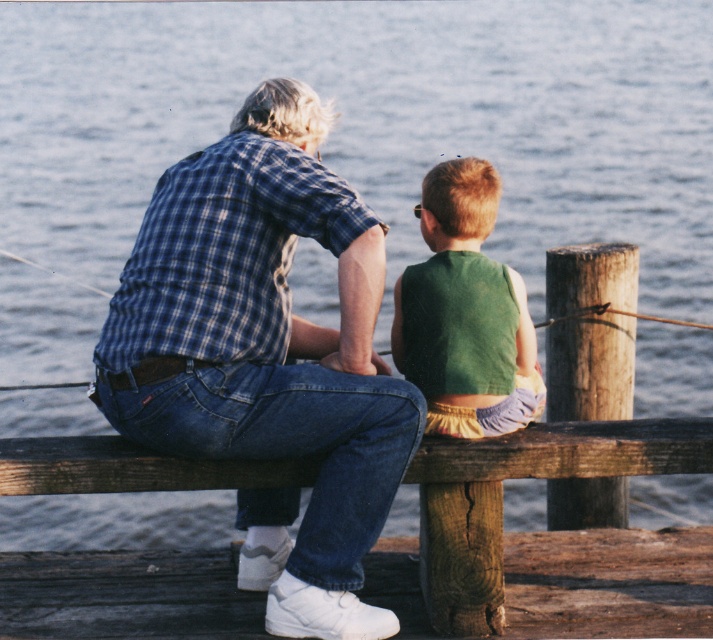
Question: Which of the following is the farthest from the observer?

Choices:
 (A) wooden bench at center
 (B) green fabric vest at center

Answer: (A)

Question: Which point is closer to the camera taking this photo?

Choices:
 (A) (461, 340)
 (B) (318, 634)

Answer: (B)

Question: Can you confirm if blue plaid shirt at upper left is thinner than wooden bench at center?

Choices:
 (A) no
 (B) yes

Answer: (A)

Question: Which object appears closest to the camera in this image?

Choices:
 (A) wooden bench at center
 (B) green fabric vest at center
 (C) blue plaid shirt at upper left

Answer: (C)

Question: Where is wooden bench at center located in relation to green fabric vest at center in the image?

Choices:
 (A) left
 (B) right

Answer: (B)

Question: Is blue plaid shirt at upper left closer to camera compared to green fabric vest at center?

Choices:
 (A) yes
 (B) no

Answer: (A)